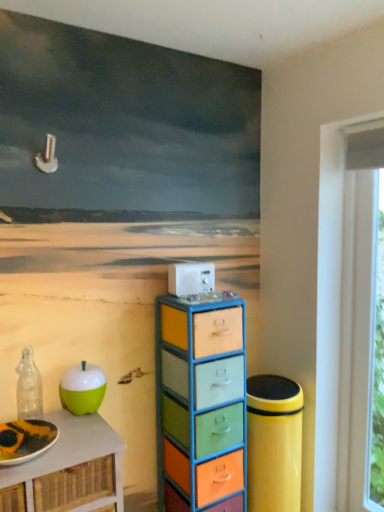
Locate an element on the screen. The height and width of the screenshot is (512, 384). vacant area that is in front of green matte apple at lower left is located at coordinates (82, 432).